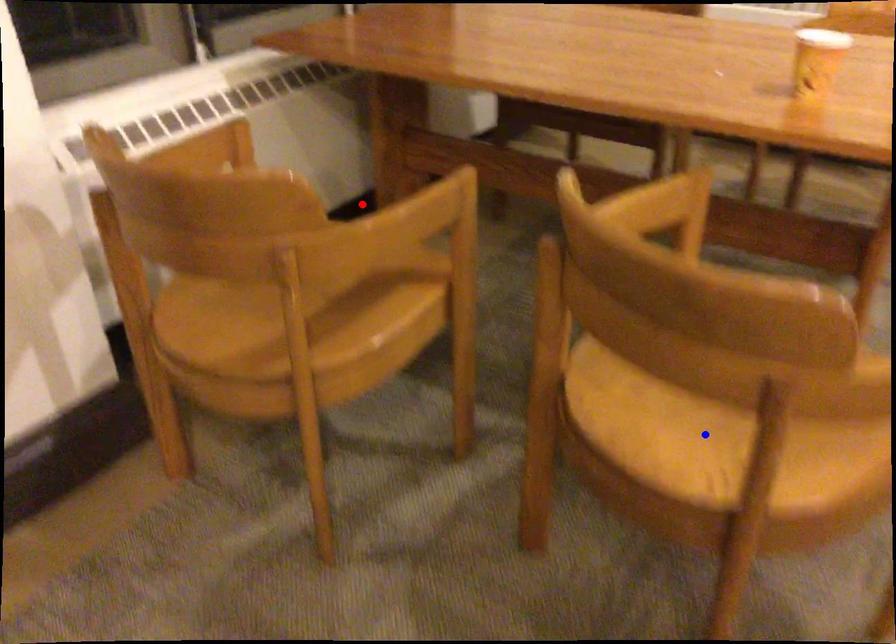
Question: In the image, two points are highlighted. Which point is nearer to the camera? Reply with the corresponding letter.

Choices:
 (A) blue point
 (B) red point

Answer: (A)